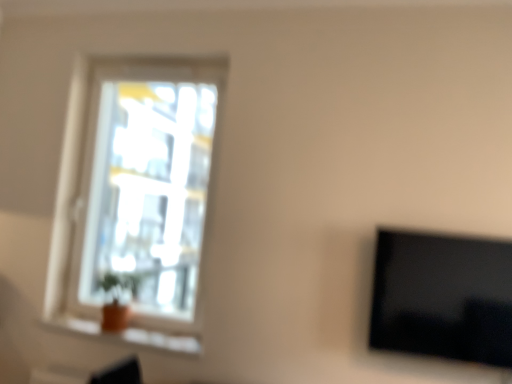
The image size is (512, 384). Describe the element at coordinates (443, 297) in the screenshot. I see `black glossy tv at right` at that location.

This screenshot has width=512, height=384. Describe the element at coordinates (125, 335) in the screenshot. I see `orange clay pot at lower left` at that location.

What are the coordinates of `black glossy tv at right` in the screenshot? It's located at (443, 297).

Which is in front, black glossy tv at right or transparent glass window at upper left?

black glossy tv at right.

From a real-world perspective, is black glossy tv at right below transparent glass window at upper left?

Yes, from a real-world perspective, black glossy tv at right is beneath transparent glass window at upper left.

You are a GUI agent. You are given a task and a screenshot of the screen. Output one action in this format:
    pyautogui.click(x=<x>, y=<y>)
    Task: Click on the television below the transparent glass window at upper left (from the image's perspective)
    This screenshot has width=512, height=384.
    Given the screenshot: What is the action you would take?
    pyautogui.click(x=443, y=297)

Is black glossy tv at right bigger or smaller than transparent glass window at upper left?

Clearly, black glossy tv at right is smaller in size than transparent glass window at upper left.

Is black glossy tv at right inside the boundaries of orange clay pot at lower left, or outside?

black glossy tv at right is spatially situated outside orange clay pot at lower left.

Is black glossy tv at right further to the viewer compared to orange clay pot at lower left?

No.

How different are the orientations of black glossy tv at right and orange clay pot at lower left in degrees?

black glossy tv at right and orange clay pot at lower left are facing 0.232 degrees away from each other.

Between black glossy tv at right and orange clay pot at lower left, which one has more height?

black glossy tv at right is taller.

Are orange clay pot at lower left and black glossy tv at right far apart?

Yes, orange clay pot at lower left and black glossy tv at right are quite far apart.

In terms of width, does orange clay pot at lower left look wider or thinner when compared to black glossy tv at right?

Considering their sizes, orange clay pot at lower left looks broader than black glossy tv at right.

Is point (180, 341) positioned after point (466, 268)?

That is True.

Consider the image. Is orange clay pot at lower left facing towards black glossy tv at right?

No, orange clay pot at lower left does not turn towards black glossy tv at right.

Considering the relative sizes of transparent glass window at upper left and black glossy tv at right in the image provided, is transparent glass window at upper left bigger than black glossy tv at right?

Correct, transparent glass window at upper left is larger in size than black glossy tv at right.

Considering the positions of objects transparent glass window at upper left and black glossy tv at right in the image provided, who is in front, transparent glass window at upper left or black glossy tv at right?

black glossy tv at right is closer to the camera.

Is transparent glass window at upper left positioned with its back to black glossy tv at right?

That's not correct — transparent glass window at upper left is not looking away from black glossy tv at right.

In the scene shown: From a real-world perspective, is orange clay pot at lower left above or below transparent glass window at upper left?

Clearly, from a real-world perspective, orange clay pot at lower left is below transparent glass window at upper left.

Between orange clay pot at lower left and transparent glass window at upper left, which one appears on the left side from the viewer's perspective?

orange clay pot at lower left.

This screenshot has width=512, height=384. In order to click on window above the orange clay pot at lower left (from the image's perspective) in this screenshot , I will do click(136, 197).

Is transparent glass window at upper left positioned with its back to orange clay pot at lower left?

transparent glass window at upper left is not turned away from orange clay pot at lower left.

Between transparent glass window at upper left and orange clay pot at lower left, which one appears on the right side from the viewer's perspective?

Positioned to the right is transparent glass window at upper left.

Relative to orange clay pot at lower left, is transparent glass window at upper left in front or behind?

transparent glass window at upper left is positioned farther from the viewer than orange clay pot at lower left.

Identify the location of window on the left of black glossy tv at right. pos(136,197).

In the image, there is a orange clay pot at lower left. Where is `television above it (from the image's perspective)`? The image size is (512, 384). television above it (from the image's perspective) is located at coordinates (443, 297).

Estimate the real-world distances between objects in this image. Which object is closer to orange clay pot at lower left, transparent glass window at upper left or black glossy tv at right?

black glossy tv at right is positioned closer to the anchor orange clay pot at lower left.

Looking at the image, which one is located further to transparent glass window at upper left, orange clay pot at lower left or black glossy tv at right?

Among the two, black glossy tv at right is located further to transparent glass window at upper left.

Considering their positions, is black glossy tv at right positioned closer to orange clay pot at lower left than transparent glass window at upper left?

black glossy tv at right is closer to orange clay pot at lower left.

Based on their spatial positions, is black glossy tv at right or orange clay pot at lower left further from transparent glass window at upper left?

The object further to transparent glass window at upper left is black glossy tv at right.

From the image, which object appears to be nearer to black glossy tv at right, orange clay pot at lower left or transparent glass window at upper left?

Based on the image, orange clay pot at lower left appears to be nearer to black glossy tv at right.

Which object lies further to the anchor point black glossy tv at right, transparent glass window at upper left or orange clay pot at lower left?

transparent glass window at upper left.

The height and width of the screenshot is (384, 512). I want to click on window located between orange clay pot at lower left and black glossy tv at right in the left-right direction, so click(x=136, y=197).